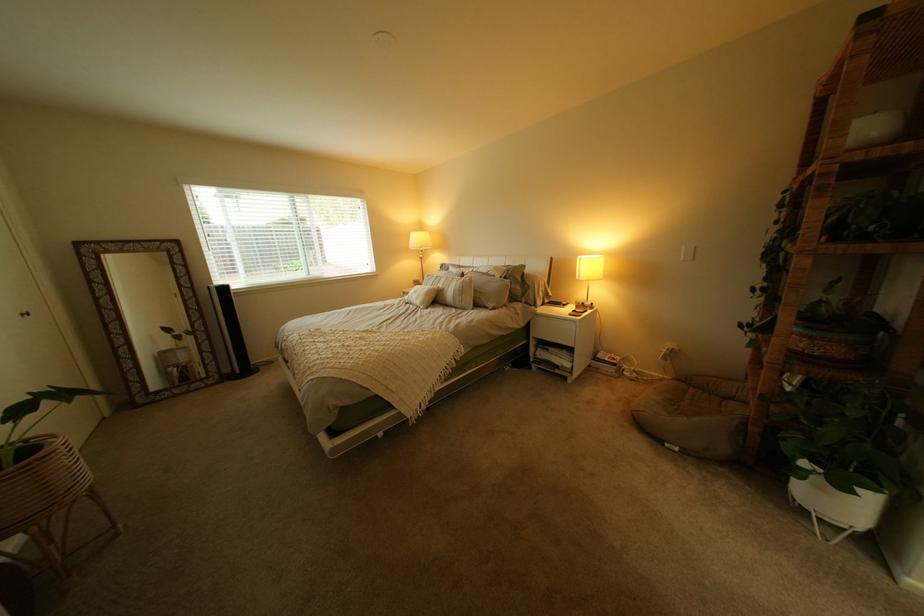
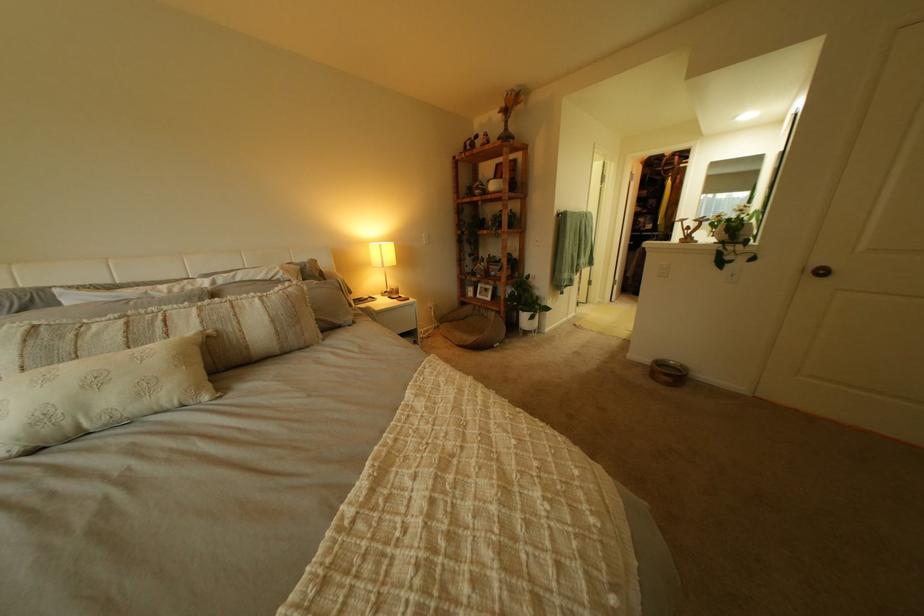
In the second image, find the point that corresponds to the point at 767,419 in the first image.

(517, 314)